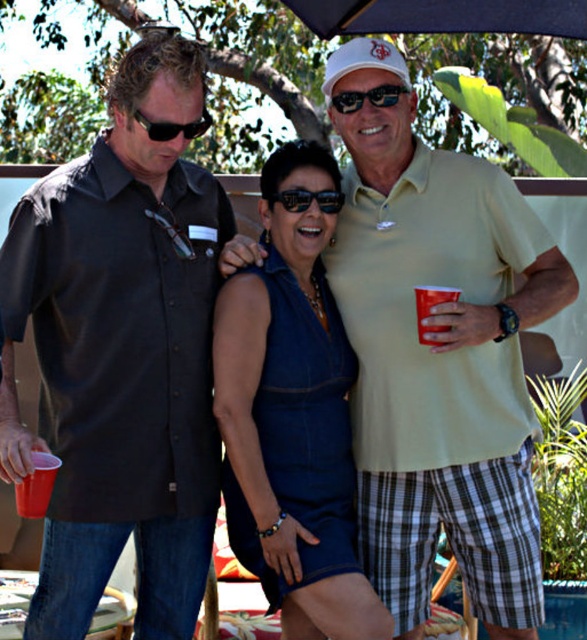
Is black matte shirt at left shorter than matte plastic cup at left?

No.

Based on the photo, is black matte shirt at left wider than matte plastic cup at left?

Indeed, black matte shirt at left has a greater width compared to matte plastic cup at left.

Describe the element at coordinates (122, 353) in the screenshot. The height and width of the screenshot is (640, 587). I see `black matte shirt at left` at that location.

I want to click on black matte shirt at left, so click(x=122, y=353).

Can you confirm if black matte shirt at left is smaller than black plastic sunglasses at center?

No.

The width and height of the screenshot is (587, 640). What do you see at coordinates (122, 353) in the screenshot?
I see `black matte shirt at left` at bounding box center [122, 353].

You are a GUI agent. You are given a task and a screenshot of the screen. Output one action in this format:
    pyautogui.click(x=<x>, y=<y>)
    Task: Click on the black matte shirt at left
    
    Given the screenshot: What is the action you would take?
    pyautogui.click(x=122, y=353)

Is matte plastic cup at left positioned behind black plastic sunglasses at upper left?

No.

Who is more distant from viewer, [22,488] or [161,131]?

Point [161,131]

Does point (52, 474) come in front of point (203, 120)?

Yes.

Find the location of a particular element. The height and width of the screenshot is (640, 587). matte plastic cup at left is located at coordinates (36, 484).